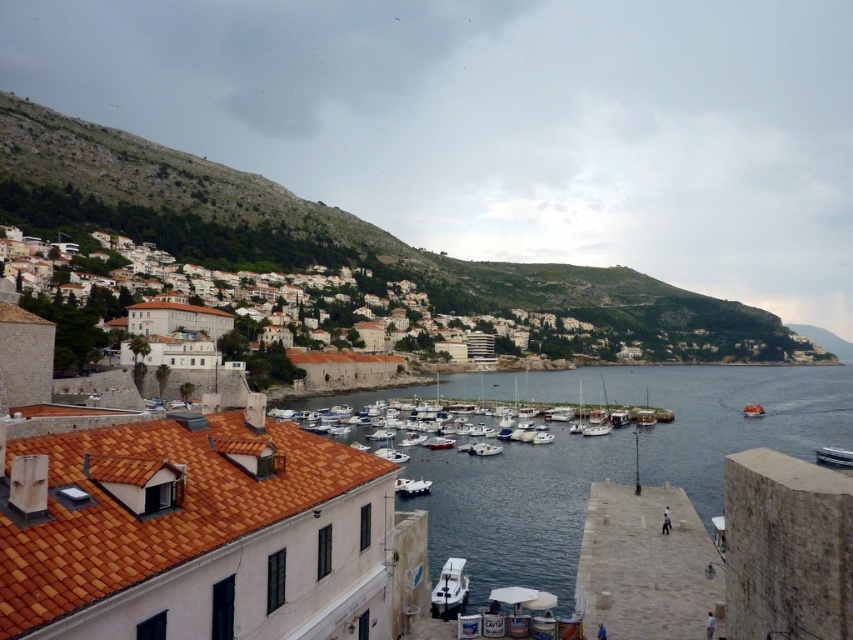
Question: Is clear blue water at center bigger than orange fabric lifeboat at lower right?

Choices:
 (A) no
 (B) yes

Answer: (B)

Question: Which object appears farthest from the camera in this image?

Choices:
 (A) white glossy boat at lower center
 (B) white stone buildings at center
 (C) stone pier at lower right
 (D) white glossy boat at center

Answer: (D)

Question: Is clear blue water at center closer to camera compared to white stone buildings at center?

Choices:
 (A) yes
 (B) no

Answer: (A)

Question: Is clear blue water at center further to the viewer compared to white glossy boat at center?

Choices:
 (A) yes
 (B) no

Answer: (B)

Question: Among these objects, which one is farthest from the camera?

Choices:
 (A) white glossy boat at lower right
 (B) clear blue water at center
 (C) white matte boat at center
 (D) white glossy boat at center

Answer: (D)

Question: Which of the following is the farthest from the observer?

Choices:
 (A) (404, 486)
 (B) (492, 444)

Answer: (B)